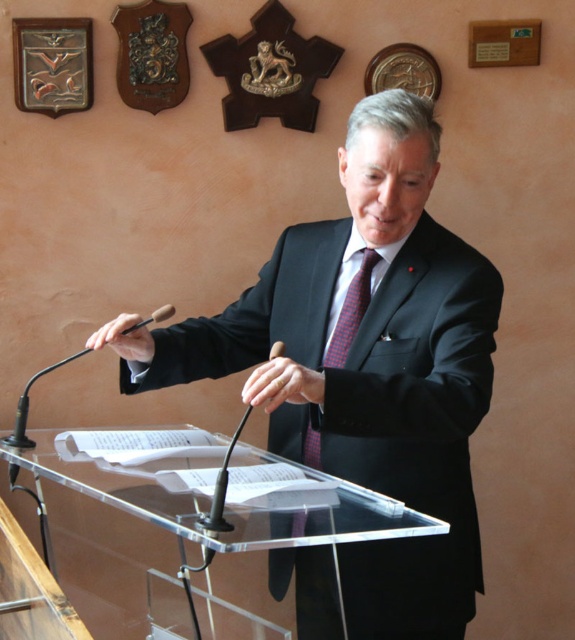
Question: Which of the following is the farthest from the observer?

Choices:
 (A) black glossy suit at center
 (B) transparent acrylic podium at center

Answer: (A)

Question: Estimate the real-world distances between objects in this image. Which object is closer to the red checkered tie at center?

Choices:
 (A) transparent acrylic podium at center
 (B) black glossy suit at center

Answer: (B)

Question: Which point is farther from the camera taking this photo?

Choices:
 (A) [405, 556]
 (B) [343, 525]

Answer: (A)

Question: Does black glossy suit at center have a larger size compared to transparent acrylic podium at center?

Choices:
 (A) no
 (B) yes

Answer: (B)

Question: Can you confirm if black glossy suit at center is wider than red checkered tie at center?

Choices:
 (A) yes
 (B) no

Answer: (A)

Question: Does black glossy suit at center appear on the right side of transparent acrylic podium at center?

Choices:
 (A) no
 (B) yes

Answer: (B)